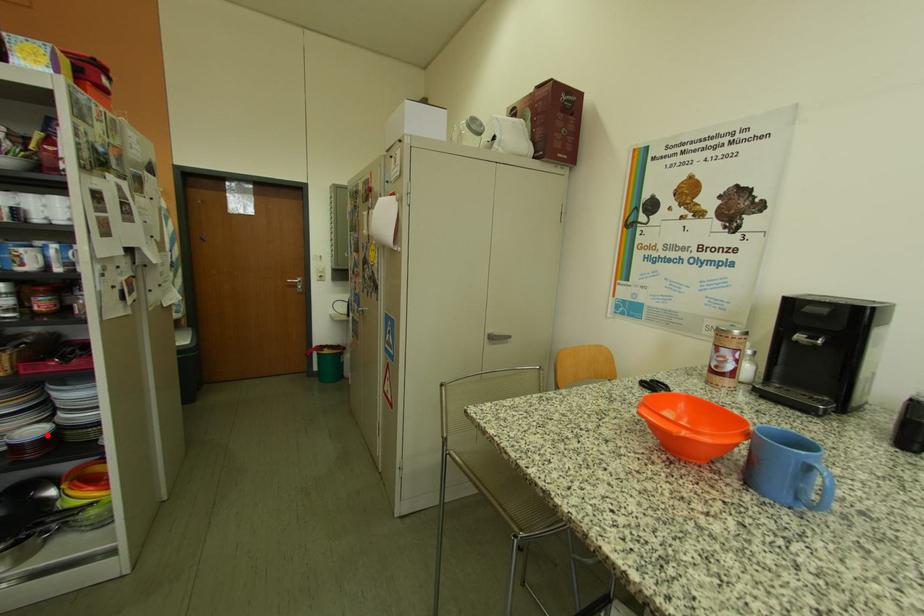
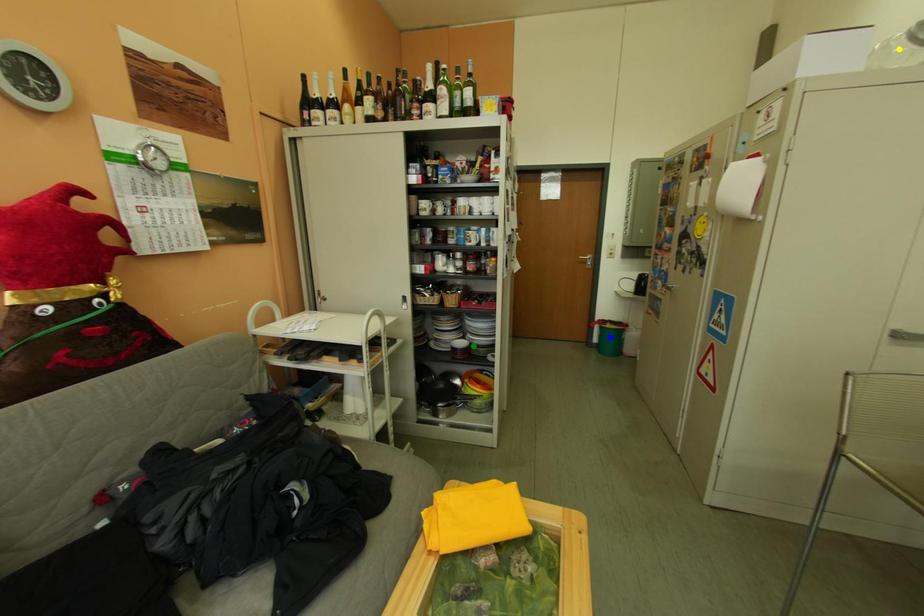
Question: I am providing you with two images of the same scene from different viewpoints. A red point is marked on the first image. You are given multiple points on the second image. Which mark in image 2 goes with the point in image 1?

Choices:
 (A) blue point
 (B) green point
 (C) yellow point

Answer: (B)